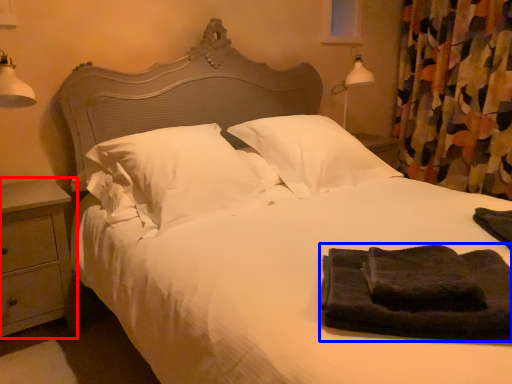
Question: Among these objects, which one is nearest to the camera, nightstand (highlighted by a red box) or material (highlighted by a blue box)?

Choices:
 (A) nightstand
 (B) material

Answer: (B)